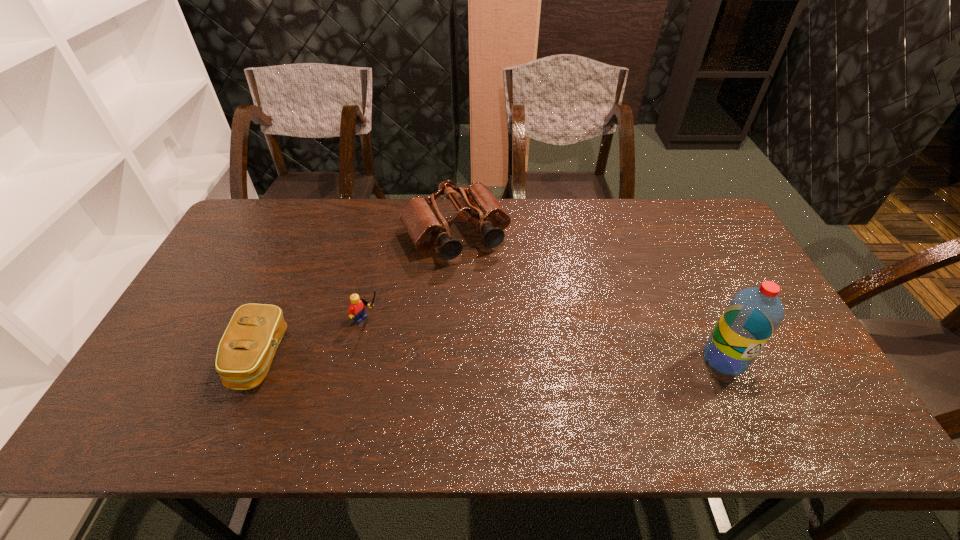
Locate an element on the screen. The height and width of the screenshot is (540, 960). free spot between the water bottle and the third object from left to right is located at coordinates (590, 298).

The width and height of the screenshot is (960, 540). Identify the location of unoccupied position between the second tallest object and the Lego. (412, 278).

The image size is (960, 540). Find the location of `free space between the Lego and the clutch bag`. free space between the Lego and the clutch bag is located at coordinates pyautogui.click(x=314, y=339).

Identify which object is the second nearest to the Lego. Please provide its 2D coordinates. Your answer should be formatted as a tuple, i.e. [(x, y)], where the tuple contains the x and y coordinates of a point satisfying the conditions above.

[(426, 226)]

Select which object is the second closest to the water bottle. Please provide its 2D coordinates. Your answer should be formatted as a tuple, i.e. [(x, y)], where the tuple contains the x and y coordinates of a point satisfying the conditions above.

[(356, 310)]